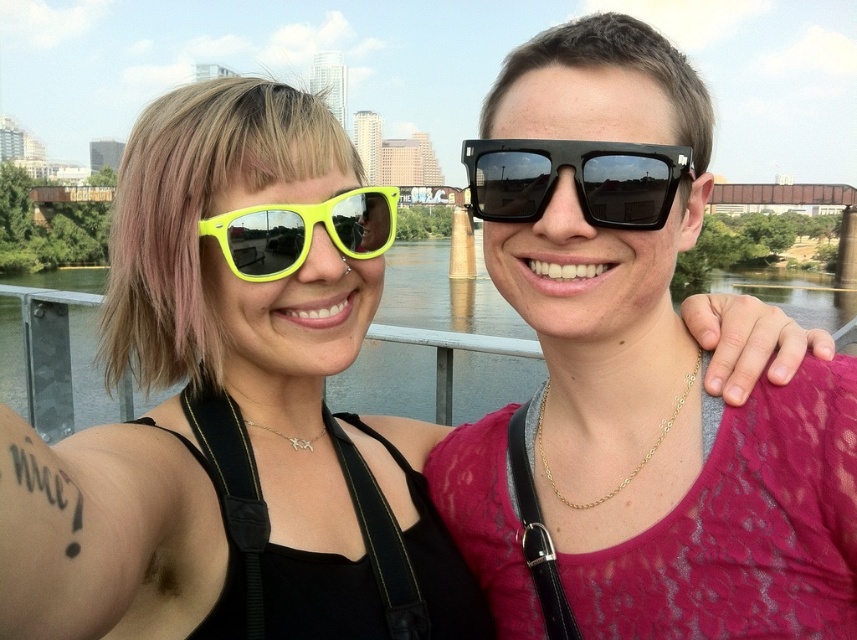
You are a photographer trying to adjust the lighting for a portrait. You notice a bright spot at point (234, 406) in the image. Which object is causing this glare? Please name the object exactly as listed in the scene description.

The bright spot at point (234, 406) corresponds to the neon yellow plastic sunglasses at upper left.

You are a photographer trying to capture the perfect selfie. You notice a point at coordinates (436, 342) in the image. Based on the scene description, what object or feature is located at this point?

The point at coordinates (436, 342) corresponds to the greenish water at center.